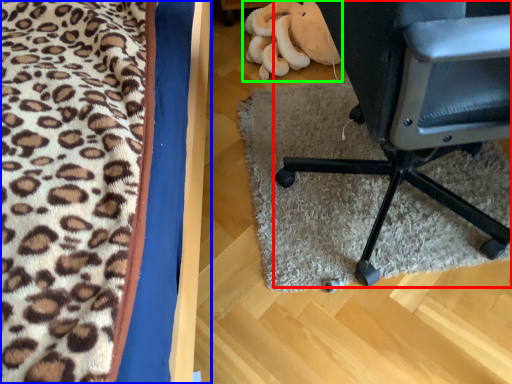
Question: Which is nearer to the chair (highlighted by a red box)? furniture (highlighted by a blue box) or stuff (highlighted by a green box).

Choices:
 (A) furniture
 (B) stuff

Answer: (A)